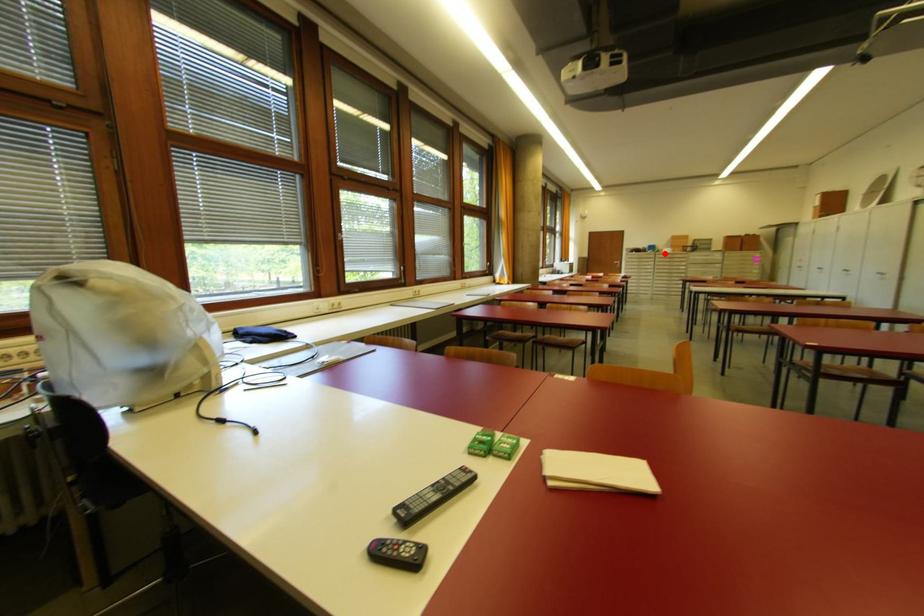
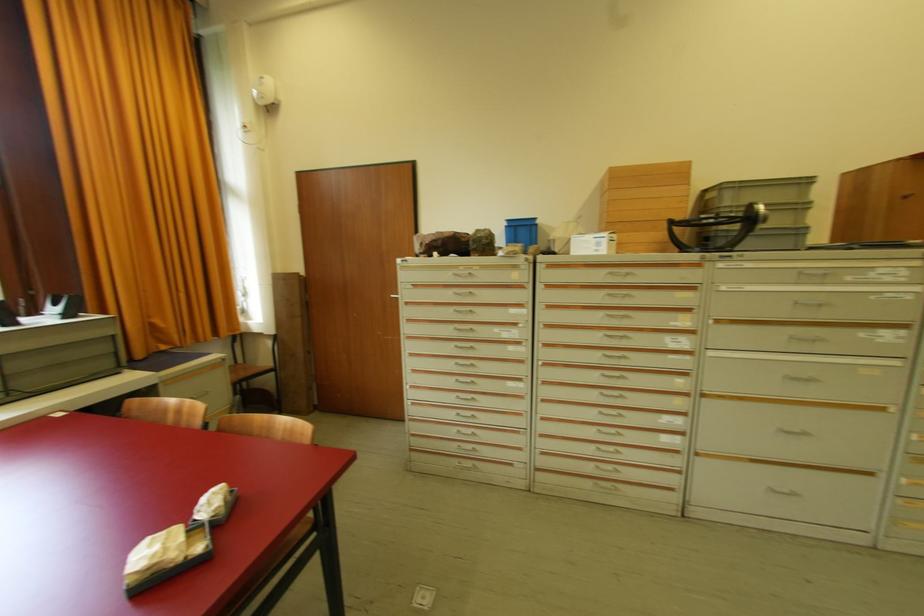
Question: I am providing you with two images of the same scene from different viewpoints. Image1 has a red point marked. In image2, the corresponding 3D location appears at what relative position? Reply with the corresponding letter.

Choices:
 (A) Closer
 (B) Farther

Answer: (B)